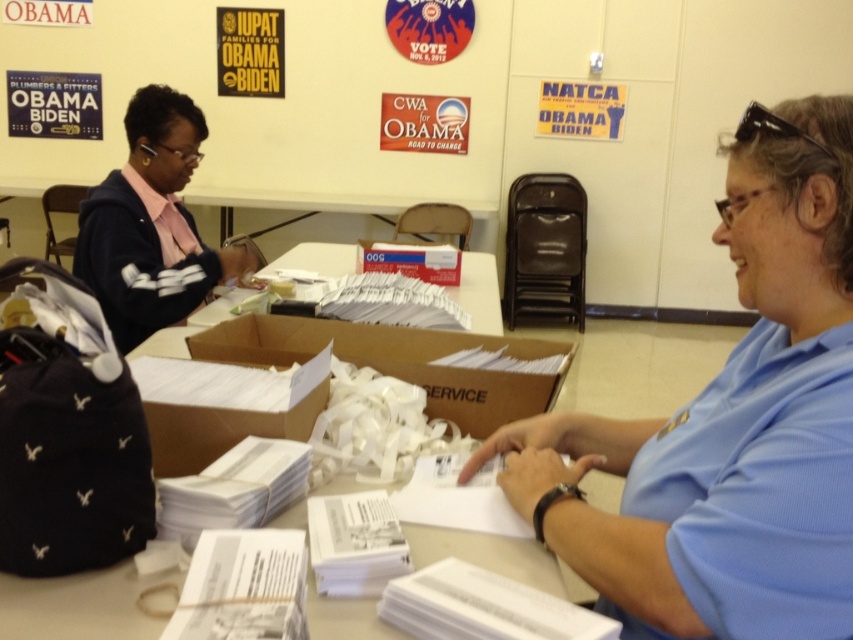
Question: Can you confirm if cardboard box at center is positioned below brown cardboard box at center?

Choices:
 (A) yes
 (B) no

Answer: (B)

Question: Is cardboard box at center smaller than brown cardboard box at center?

Choices:
 (A) no
 (B) yes

Answer: (A)

Question: Which is nearer to the brown cardboard box at center?

Choices:
 (A) cardboard box at center
 (B) black plastic sunglasses at upper right

Answer: (A)

Question: Is blue shirt at center smaller than brown cardboard box at center?

Choices:
 (A) no
 (B) yes

Answer: (A)

Question: Among these objects, which one is farthest from the camera?

Choices:
 (A) dark blue sweater at left
 (B) brown cardboard box at center
 (C) blue shirt at center

Answer: (A)

Question: Which of the following is the farthest from the observer?

Choices:
 (A) matte cardboard box at center
 (B) dark blue sweater at left
 (C) brown cardboard box at center

Answer: (A)